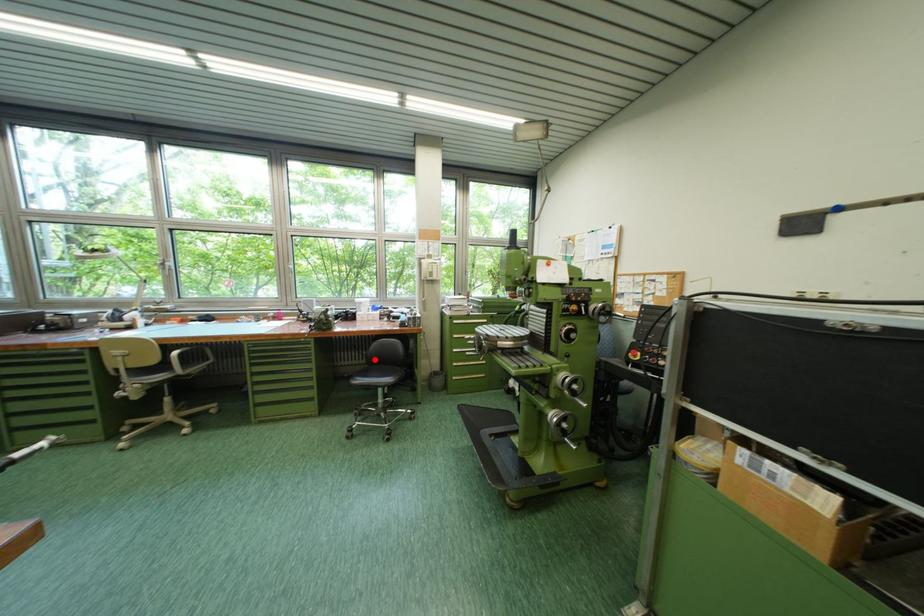
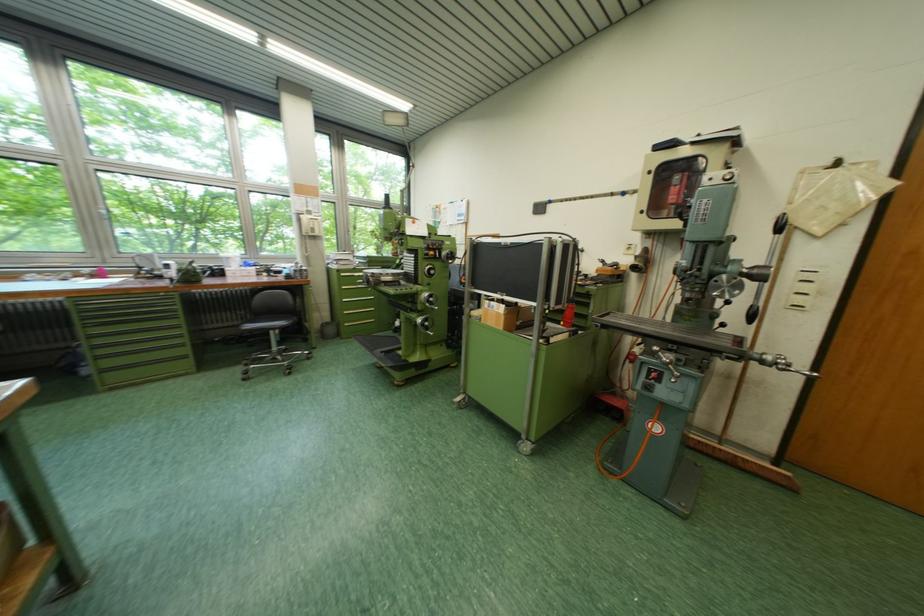
Question: I am providing you with two images of the same scene from different viewpoints. A red point is shown in image1. For the corresponding object point in image2, is it positioned nearer or farther from the camera?

Choices:
 (A) Nearer
 (B) Farther

Answer: (A)